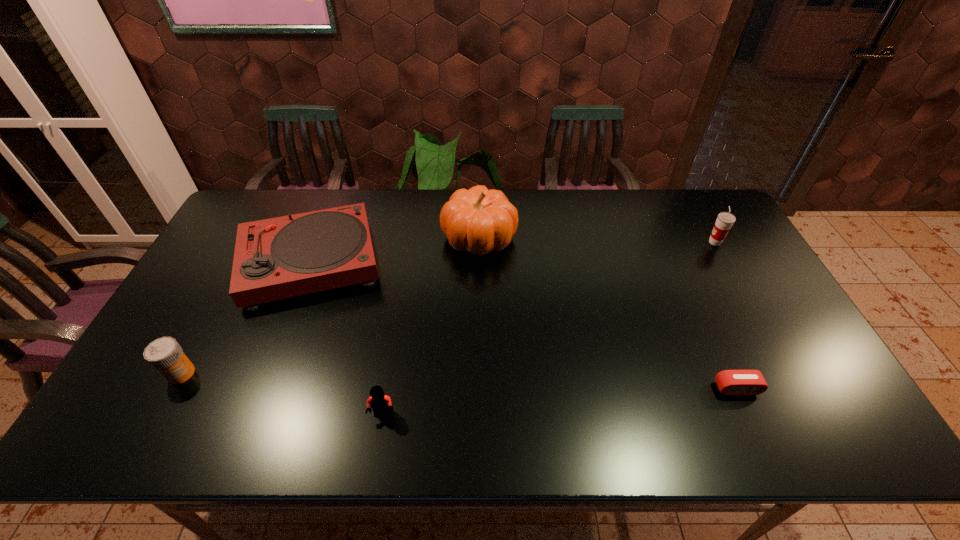
The height and width of the screenshot is (540, 960). In order to click on pumpkin in this screenshot , I will do `click(478, 220)`.

Identify the location of the tallest object. The image size is (960, 540). (478, 220).

In order to click on cup in this screenshot , I will do `click(725, 220)`.

Where is `the second tallest object`? The image size is (960, 540). the second tallest object is located at coordinates (725, 220).

This screenshot has width=960, height=540. What are the coordinates of `record player` in the screenshot? It's located at (283, 257).

Find the location of a particular element. This screenshot has height=540, width=960. medicine is located at coordinates (165, 354).

Find the location of a particular element. This screenshot has width=960, height=540. Lego is located at coordinates (380, 403).

Find the location of `the nearest object`. the nearest object is located at coordinates (380, 403).

I want to click on alarm clock, so (x=730, y=382).

Locate an element on the screen. the shortest object is located at coordinates (730, 382).